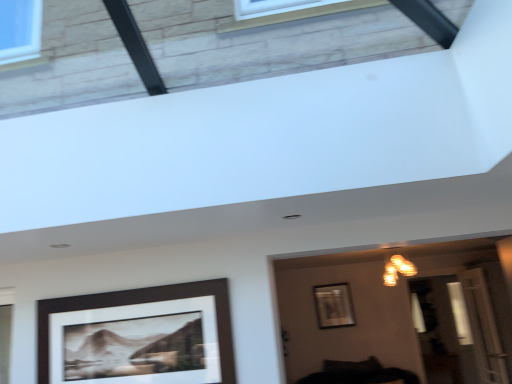
Question: Choose the correct answer: Is black matte picture frame at lower left, the 2th picture frame from the back, inside transparent glass door at lower right or outside it?

Choices:
 (A) outside
 (B) inside

Answer: (A)

Question: From their relative heights in the image, would you say black matte picture frame at lower left, placed as the second picture frame when sorted from bottom to top, is taller or shorter than transparent glass door at lower right?

Choices:
 (A) tall
 (B) short

Answer: (B)

Question: Based on their relative distances, which object is nearer to the black matte picture frame at lower left, placed as the second picture frame when sorted from bottom to top?

Choices:
 (A) transparent glass door at lower right
 (B) metallic silver picture frame at center, which appears as the 2th picture frame when viewed from the front
 (C) warm matte light fixture at upper center

Answer: (B)

Question: Which is farther from the black matte picture frame at lower left, the 1th picture frame positioned from the top?

Choices:
 (A) metallic silver picture frame at center, the second picture frame positioned from the left
 (B) warm matte light fixture at upper center
 (C) transparent glass door at lower right

Answer: (C)